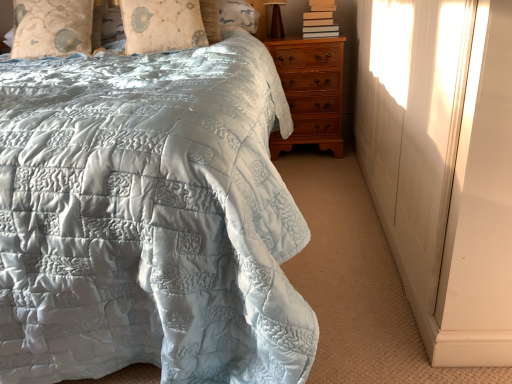
Question: Considering the relative sizes of hardcover books at upper right and matte quilted bedspread at center in the image provided, is hardcover books at upper right smaller than matte quilted bedspread at center?

Choices:
 (A) no
 (B) yes

Answer: (B)

Question: Could you tell me if hardcover books at upper right is facing matte quilted bedspread at center?

Choices:
 (A) no
 (B) yes

Answer: (A)

Question: From a real-world perspective, is hardcover books at upper right on top of matte quilted bedspread at center?

Choices:
 (A) yes
 (B) no

Answer: (A)

Question: Is hardcover books at upper right directly adjacent to matte quilted bedspread at center?

Choices:
 (A) yes
 (B) no

Answer: (B)

Question: Does hardcover books at upper right have a greater height compared to matte quilted bedspread at center?

Choices:
 (A) yes
 (B) no

Answer: (B)

Question: Is hardcover books at upper right shorter than matte quilted bedspread at center?

Choices:
 (A) no
 (B) yes

Answer: (B)

Question: Is the depth of hardcover books at upper right less than that of brown wooden table lamp at upper right?

Choices:
 (A) no
 (B) yes

Answer: (B)

Question: Considering the relative positions of hardcover books at upper right and brown wooden table lamp at upper right in the image provided, is hardcover books at upper right behind brown wooden table lamp at upper right?

Choices:
 (A) no
 (B) yes

Answer: (A)

Question: From a real-world perspective, is hardcover books at upper right on top of brown wooden table lamp at upper right?

Choices:
 (A) no
 (B) yes

Answer: (A)

Question: Is hardcover books at upper right taller than brown wooden table lamp at upper right?

Choices:
 (A) yes
 (B) no

Answer: (B)

Question: From a real-world perspective, is hardcover books at upper right located beneath brown wooden table lamp at upper right?

Choices:
 (A) no
 (B) yes

Answer: (B)

Question: Considering the relative sizes of hardcover books at upper right and brown wooden table lamp at upper right in the image provided, is hardcover books at upper right wider than brown wooden table lamp at upper right?

Choices:
 (A) no
 (B) yes

Answer: (B)

Question: Considering the relative sizes of brown wooden table lamp at upper right and silky beige pillow at upper center, arranged as the second pillow when viewed from the left, in the image provided, is brown wooden table lamp at upper right smaller than silky beige pillow at upper center, arranged as the second pillow when viewed from the left,?

Choices:
 (A) no
 (B) yes

Answer: (B)